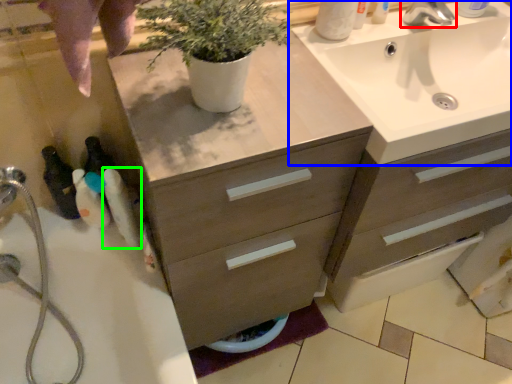
Question: Which object is positioned closest to tap (highlighted by a red box)? Select from sink (highlighted by a blue box) and toiletry (highlighted by a green box).

Choices:
 (A) sink
 (B) toiletry

Answer: (A)